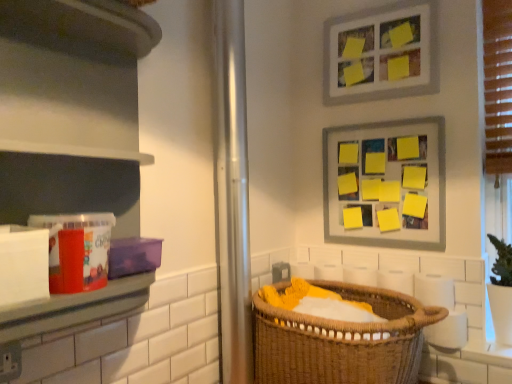
Question: Is matte plastic container at left not close to metallic silver screen door at center?

Choices:
 (A) no
 (B) yes

Answer: (A)

Question: Is matte plastic container at left at the left side of metallic silver screen door at center?

Choices:
 (A) no
 (B) yes

Answer: (B)

Question: Is the depth of matte plastic container at left greater than that of metallic silver screen door at center?

Choices:
 (A) yes
 (B) no

Answer: (B)

Question: From the image's perspective, is matte plastic container at left located above metallic silver screen door at center?

Choices:
 (A) yes
 (B) no

Answer: (A)

Question: Can you confirm if matte plastic container at left is smaller than metallic silver screen door at center?

Choices:
 (A) yes
 (B) no

Answer: (B)

Question: In the image, is yellow paper/magnetic board at upper right, which is the 1th picture frame from bottom to top, on the left side or the right side of brown woven basket at lower center?

Choices:
 (A) left
 (B) right

Answer: (B)

Question: Considering the positions of yellow paper/magnetic board at upper right, which is the 1th picture frame from bottom to top, and brown woven basket at lower center in the image, is yellow paper/magnetic board at upper right, which is the 1th picture frame from bottom to top, wider or thinner than brown woven basket at lower center?

Choices:
 (A) thin
 (B) wide

Answer: (A)

Question: Is yellow paper/magnetic board at upper right, which is the 1th picture frame from bottom to top, in front of or behind brown woven basket at lower center in the image?

Choices:
 (A) front
 (B) behind

Answer: (B)

Question: Considering the positions of yellow paper/magnetic board at upper right, which is the 1th picture frame from bottom to top, and brown woven basket at lower center in the image, is yellow paper/magnetic board at upper right, which is the 1th picture frame from bottom to top, taller or shorter than brown woven basket at lower center?

Choices:
 (A) tall
 (B) short

Answer: (A)

Question: From their relative heights in the image, would you say matte plastic container at left is taller or shorter than matte gray picture frame at upper center, which is the 1th picture frame in top-to-bottom order?

Choices:
 (A) short
 (B) tall

Answer: (B)

Question: Is matte plastic container at left wider or thinner than matte gray picture frame at upper center, which is the 1th picture frame in top-to-bottom order?

Choices:
 (A) wide
 (B) thin

Answer: (A)

Question: Is matte plastic container at left inside the boundaries of matte gray picture frame at upper center, which is the 1th picture frame in top-to-bottom order, or outside?

Choices:
 (A) outside
 (B) inside

Answer: (A)

Question: Based on their sizes in the image, would you say matte plastic container at left is bigger or smaller than matte gray picture frame at upper center, which is counted as the second picture frame, starting from the bottom?

Choices:
 (A) small
 (B) big

Answer: (B)

Question: Is brown woven basket at lower center taller or shorter than matte plastic container at left?

Choices:
 (A) tall
 (B) short

Answer: (B)

Question: From the image's perspective, is brown woven basket at lower center located above or below matte plastic container at left?

Choices:
 (A) below
 (B) above

Answer: (A)